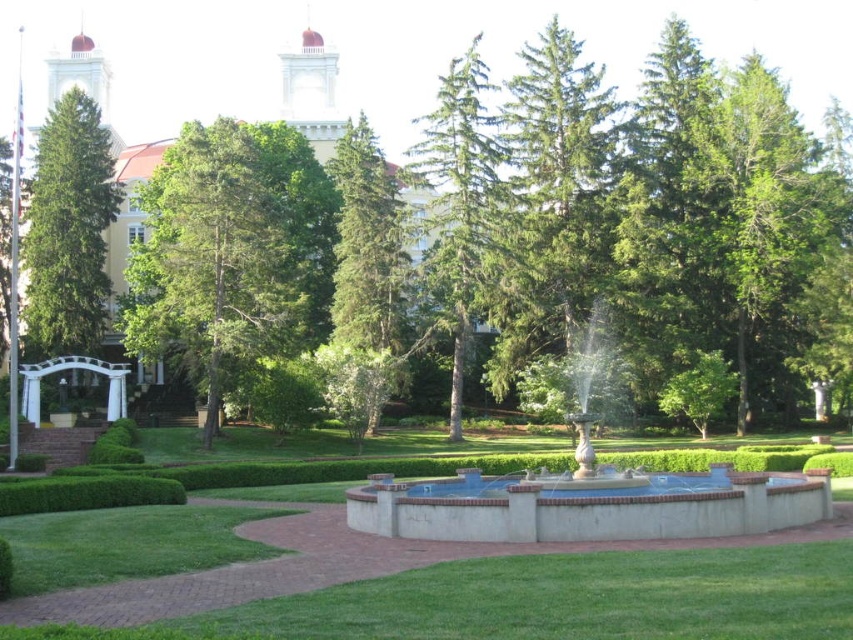
Can you confirm if blue concrete fountain at center is wider than green fir at center?

Yes.

Is blue concrete fountain at center to the right of green fir at center from the viewer's perspective?

Yes, blue concrete fountain at center is to the right of green fir at center.

Who is more forward, (434, 483) or (358, 163)?

Point (434, 483) is in front.

You are a GUI agent. You are given a task and a screenshot of the screen. Output one action in this format:
    pyautogui.click(x=<x>, y=<y>)
    Task: Click on the blue concrete fountain at center
    The image size is (853, 640).
    Given the screenshot: What is the action you would take?
    pyautogui.click(x=589, y=502)

The height and width of the screenshot is (640, 853). Find the location of `green textured pine tree at left`. green textured pine tree at left is located at coordinates (68, 230).

Is point (27, 244) positioned before point (137, 499)?

No, it is behind (137, 499).

Between point (68, 157) and point (3, 497), which one is positioned in front?

Positioned in front is point (3, 497).

Locate an element on the screen. The image size is (853, 640). green textured pine tree at left is located at coordinates (68, 230).

Looking at this image, who is positioned more to the left, green fir tree at center or green fir at center?

Positioned to the left is green fir at center.

Looking at this image, does green fir tree at center have a greater height compared to green fir at center?

Yes, green fir tree at center is taller than green fir at center.

Who is more distant from viewer, (563,128) or (370,192)?

Positioned behind is point (563,128).

This screenshot has height=640, width=853. I want to click on green fir tree at center, so click(555, 195).